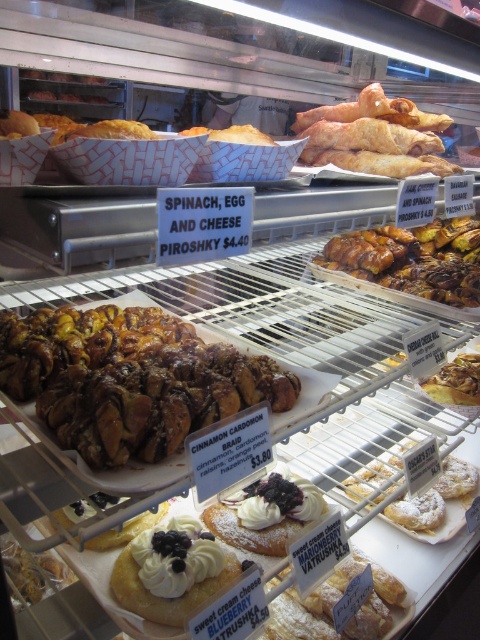
Is white cream-filled donut at center thinner than powdered sugar pastry at center?

Indeed, white cream-filled donut at center has a lesser width compared to powdered sugar pastry at center.

Does white cream-filled donut at center lie behind powdered sugar pastry at center?

No, it is not.

Locate an element on the screen. This screenshot has height=640, width=480. white cream-filled donut at center is located at coordinates (171, 572).

Locate an element on the screen. This screenshot has width=480, height=640. cinnamon-sugar pastry at center is located at coordinates (130, 380).

Between cinnamon-sugar pastry at center and powdered sugar pastry at center, which one has less height?

With less height is powdered sugar pastry at center.

Who is more forward, (71, 356) or (411, 506)?

Point (71, 356) is more forward.

You are a GUI agent. You are given a task and a screenshot of the screen. Output one action in this format:
    pyautogui.click(x=<x>, y=<y>)
    Task: Click on the cinnamon-sugar pastry at center
    
    Given the screenshot: What is the action you would take?
    pyautogui.click(x=130, y=380)

Is cinnamon-sugar pastry at center in front of white powdered sugar blueberry-filled pastry at center?

Yes, it is.

Is point (63, 328) behind point (262, 522)?

No, (63, 328) is closer to viewer.

At what (x,y) coordinates should I click in order to perform the action: click on cinnamon-sugar pastry at center. Please return your answer as a coordinate pair (x, y). This screenshot has height=640, width=480. Looking at the image, I should click on pyautogui.click(x=130, y=380).